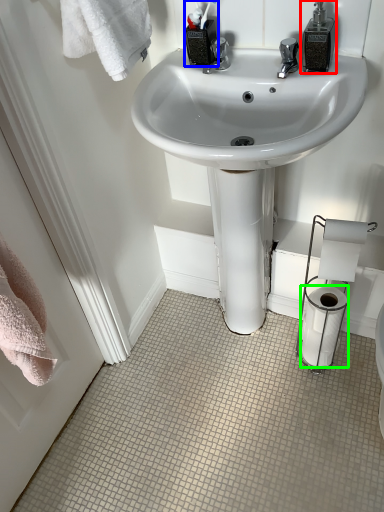
Question: Which is farther away from soap dispenser (highlighted by a red box)? toiletry (highlighted by a blue box) or toilet paper (highlighted by a green box)?

Choices:
 (A) toiletry
 (B) toilet paper

Answer: (B)